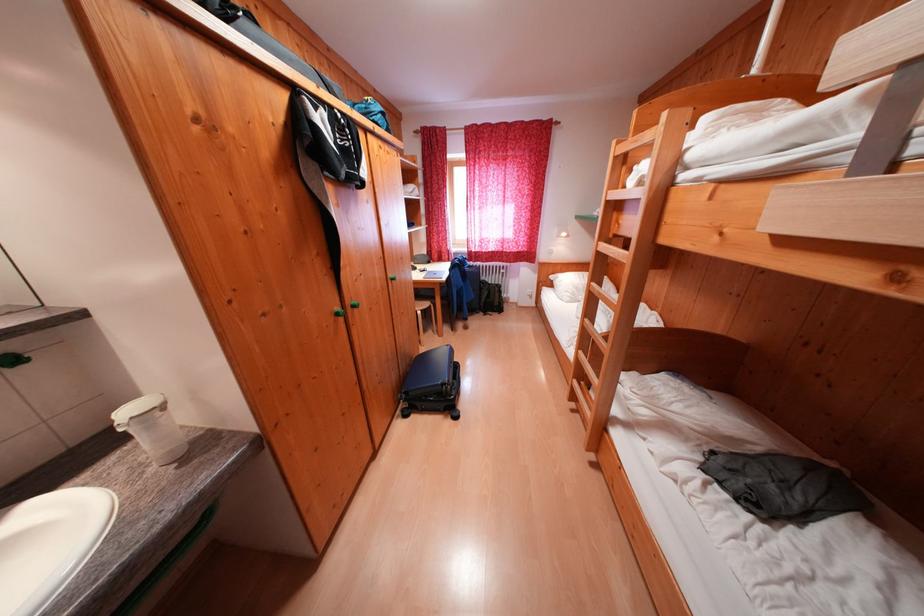
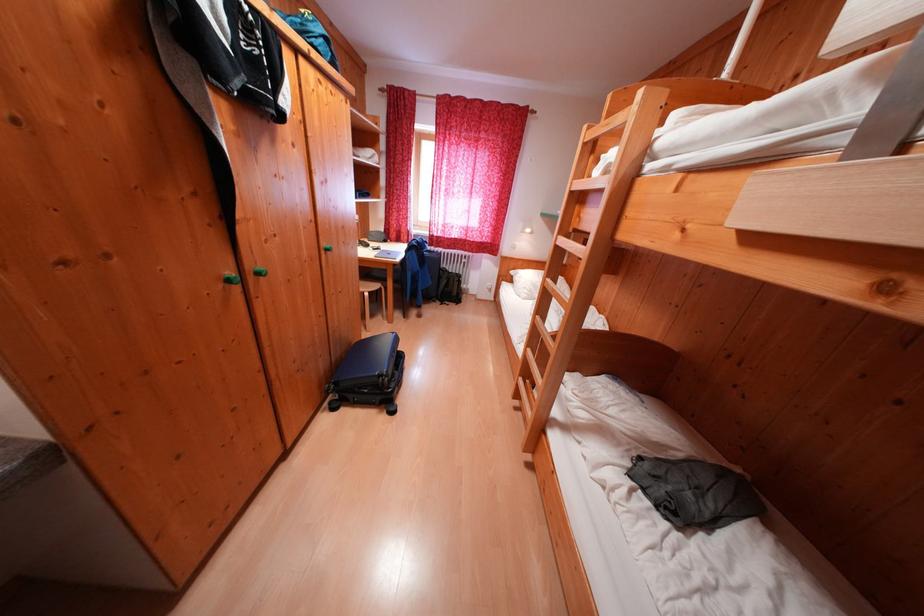
What movement of the cameraman would produce the second image?

The cameraman walked toward right, forward.